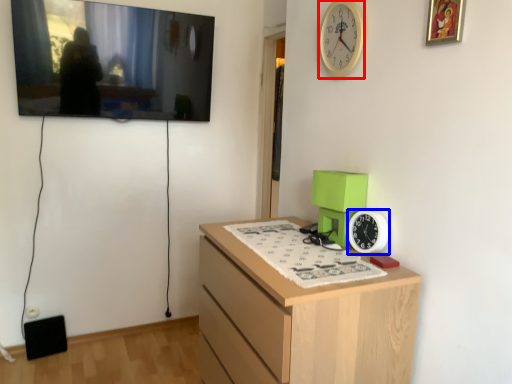
Question: Which object appears farthest to the camera in this image, clock (highlighted by a red box) or clock (highlighted by a blue box)?

Choices:
 (A) clock
 (B) clock

Answer: (A)